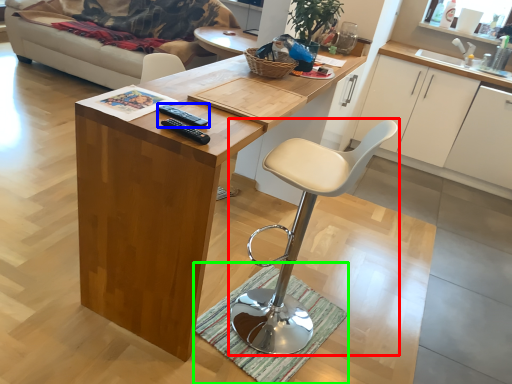
Question: Based on their relative distances, which object is nearer to chair (highlighted by a red box)? Choose from remote (highlighted by a blue box) and doormat (highlighted by a green box).

Choices:
 (A) remote
 (B) doormat

Answer: (B)